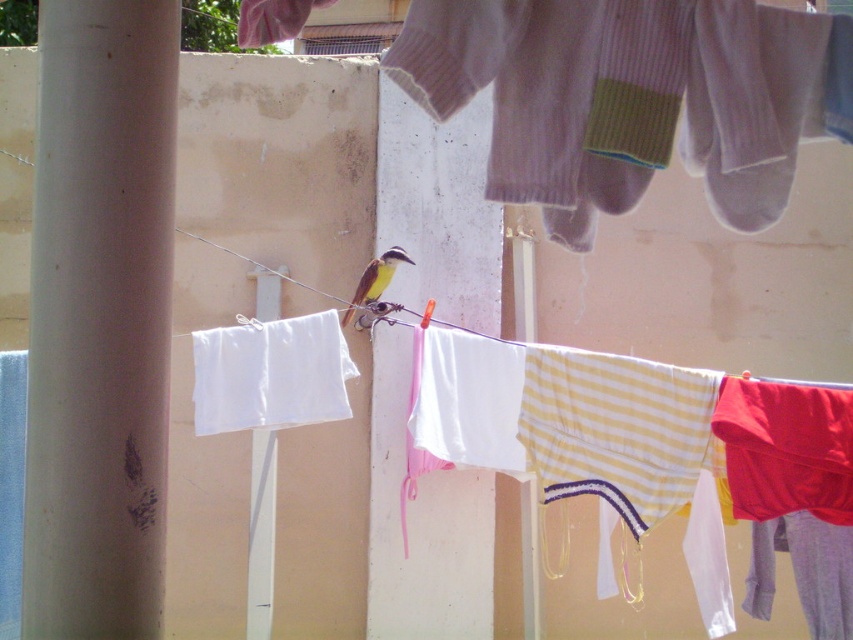
Looking at this image, does ribbed wool socks at upper center come in front of white smooth pole at center?

That is True.

Does point (598, 196) come farther from viewer compared to point (273, 556)?

No, it is in front of (273, 556).

Find the location of `ribbed wool socks at upper center`. ribbed wool socks at upper center is located at coordinates (631, 97).

Can you confirm if white fabric at center is positioned below brown feathered bird at center?

Correct, white fabric at center is located below brown feathered bird at center.

The image size is (853, 640). What do you see at coordinates (270, 374) in the screenshot?
I see `white fabric at center` at bounding box center [270, 374].

The width and height of the screenshot is (853, 640). Identify the location of white fabric at center. (270, 374).

Who is higher up, white smooth pole at left or brown feathered bird at center?

Positioned higher is brown feathered bird at center.

Does white smooth pole at left appear under brown feathered bird at center?

Indeed, white smooth pole at left is positioned under brown feathered bird at center.

Is point (102, 580) in front of point (352, 305)?

Yes, point (102, 580) is in front of point (352, 305).

This screenshot has height=640, width=853. What are the coordinates of `white smooth pole at left` in the screenshot? It's located at (99, 320).